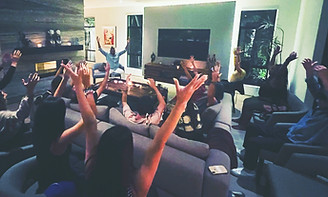
The width and height of the screenshot is (328, 197). Identify the location of chair. (125, 155).